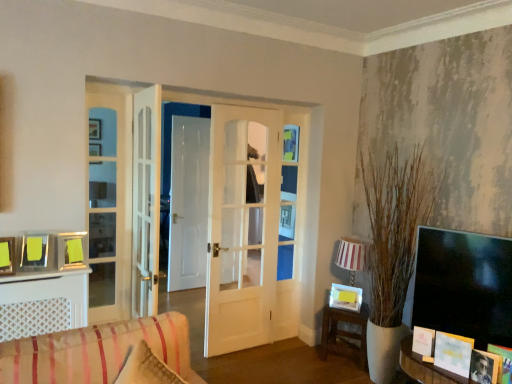
Question: Is wooden table at lower right positioned behind white paper picture frame at lower right, marked as the 3th picture frame in a back-to-front arrangement?

Choices:
 (A) no
 (B) yes

Answer: (B)

Question: From the image's perspective, is wooden table at lower right located beneath white paper picture frame at lower right, the fifth picture frame in the left-to-right sequence?

Choices:
 (A) yes
 (B) no

Answer: (A)

Question: Are wooden table at lower right and white paper picture frame at lower right, which ranks as the fifth picture frame in top-to-bottom order, located far from each other?

Choices:
 (A) no
 (B) yes

Answer: (A)

Question: Is wooden table at lower right facing away from white paper picture frame at lower right, which ranks as the fifth picture frame in top-to-bottom order?

Choices:
 (A) yes
 (B) no

Answer: (B)

Question: Can you confirm if wooden table at lower right is thinner than white paper picture frame at lower right, which ranks as the fifth picture frame in top-to-bottom order?

Choices:
 (A) yes
 (B) no

Answer: (B)

Question: Which is correct: metallic silver picture frame at left, which ranks as the 2th picture frame in left-to-right order, is inside white paper book at lower right, or outside of it?

Choices:
 (A) outside
 (B) inside

Answer: (A)

Question: In terms of height, does metallic silver picture frame at left, the 3th picture frame when ordered from top to bottom, look taller or shorter compared to white paper book at lower right?

Choices:
 (A) short
 (B) tall

Answer: (B)

Question: Is metallic silver picture frame at left, which ranks as the 2th picture frame in left-to-right order, in front of or behind white paper book at lower right in the image?

Choices:
 (A) front
 (B) behind

Answer: (A)

Question: From a real-world perspective, is metallic silver picture frame at left, acting as the 5th picture frame starting from the back, physically located above or below white paper book at lower right?

Choices:
 (A) above
 (B) below

Answer: (A)

Question: From their relative heights in the image, would you say white paper book at lower right is taller or shorter than matte black photo frame at lower right, the 1th picture frame ordered from the bottom?

Choices:
 (A) tall
 (B) short

Answer: (A)

Question: Does point (443, 369) appear closer or farther from the camera than point (475, 354)?

Choices:
 (A) closer
 (B) farther

Answer: (B)

Question: Relative to matte black photo frame at lower right, which is the 6th picture frame from left to right, is white paper book at lower right in front or behind?

Choices:
 (A) front
 (B) behind

Answer: (B)

Question: Looking at their shapes, would you say white paper book at lower right is wider or thinner than matte black photo frame at lower right, the 2th picture frame from the front?

Choices:
 (A) wide
 (B) thin

Answer: (A)

Question: From the image's perspective, is matte black photo frame at lower right, the 1th picture frame ordered from the bottom, positioned above or below white paper picture frame at lower right, which ranks as the fifth picture frame in top-to-bottom order?

Choices:
 (A) below
 (B) above

Answer: (A)

Question: Considering the relative positions of matte black photo frame at lower right, which is the 6th picture frame from left to right, and white paper picture frame at lower right, which ranks as the fifth picture frame in top-to-bottom order, in the image provided, is matte black photo frame at lower right, which is the 6th picture frame from left to right, to the left or to the right of white paper picture frame at lower right, which ranks as the fifth picture frame in top-to-bottom order,?

Choices:
 (A) left
 (B) right

Answer: (B)